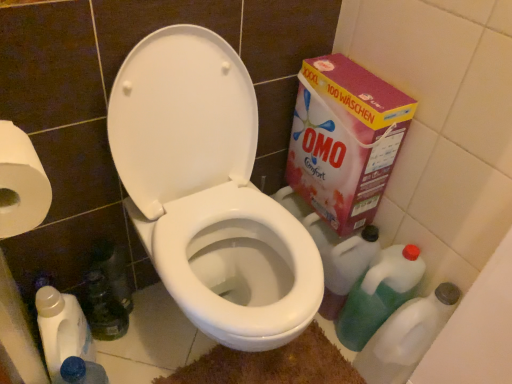
Question: Is white plastic bottle at lower left, marked as the 1th cleaning product in a left-to-right arrangement, a part of green translucent bottle at lower right, placed as the 3th cleaning product when sorted from left to right?

Choices:
 (A) yes
 (B) no

Answer: (B)

Question: From a real-world perspective, is green translucent bottle at lower right, which ranks as the second cleaning product in right-to-left order, on top of white plastic bottle at lower left, which is the 4th cleaning product from right to left?

Choices:
 (A) no
 (B) yes

Answer: (B)

Question: Does green translucent bottle at lower right, placed as the 3th cleaning product when sorted from left to right, have a lesser width compared to white plastic bottle at lower left, marked as the 1th cleaning product in a left-to-right arrangement?

Choices:
 (A) no
 (B) yes

Answer: (A)

Question: Is green translucent bottle at lower right, which ranks as the second cleaning product in right-to-left order, facing away from white plastic bottle at lower left, which is the 4th cleaning product from right to left?

Choices:
 (A) no
 (B) yes

Answer: (A)

Question: Can you confirm if green translucent bottle at lower right, placed as the 3th cleaning product when sorted from left to right, is positioned to the left of white plastic bottle at lower left, marked as the 1th cleaning product in a left-to-right arrangement?

Choices:
 (A) yes
 (B) no

Answer: (B)

Question: Is green translucent bottle at lower right, placed as the 3th cleaning product when sorted from left to right, at the right side of white plastic bottle at lower left, marked as the 1th cleaning product in a left-to-right arrangement?

Choices:
 (A) yes
 (B) no

Answer: (A)

Question: Is white glossy toilet at center outside of pink cardboard box at right?

Choices:
 (A) no
 (B) yes

Answer: (B)

Question: Is pink cardboard box at right surrounded by white glossy toilet at center?

Choices:
 (A) no
 (B) yes

Answer: (A)

Question: Can you confirm if white glossy toilet at center is wider than pink cardboard box at right?

Choices:
 (A) yes
 (B) no

Answer: (A)

Question: From a real-world perspective, is white glossy toilet at center physically above pink cardboard box at right?

Choices:
 (A) no
 (B) yes

Answer: (A)

Question: Is there a large distance between white glossy toilet at center and pink cardboard box at right?

Choices:
 (A) yes
 (B) no

Answer: (B)

Question: Considering the relative positions of white glossy toilet at center and pink cardboard box at right in the image provided, is white glossy toilet at center behind pink cardboard box at right?

Choices:
 (A) yes
 (B) no

Answer: (B)

Question: Is the surface of white glossy toilet at center in direct contact with green plastic cleaner at lower right, which is counted as the first cleaning product, starting from the right?

Choices:
 (A) yes
 (B) no

Answer: (B)